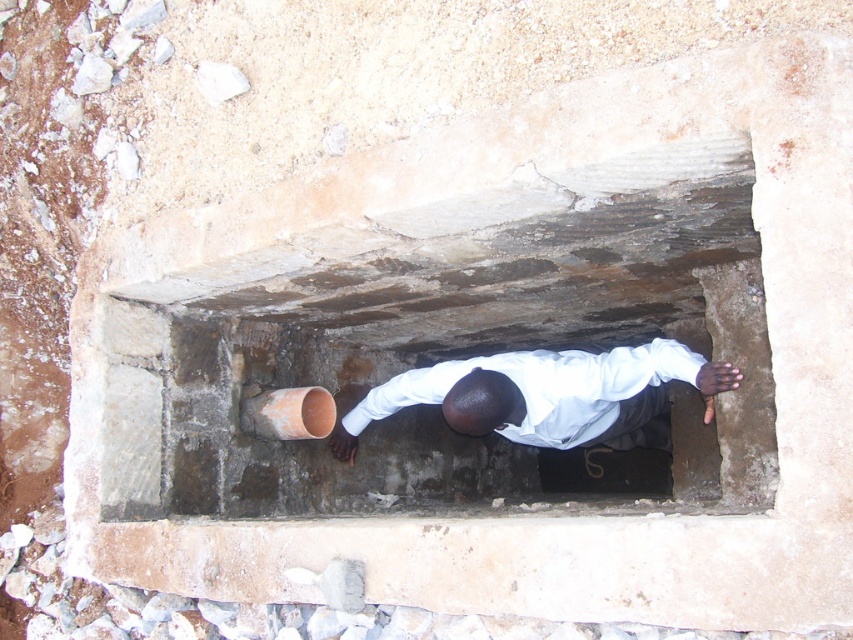
You are a construction worker needing to place a safety harness hook. You see the smooth concrete hole at center and the white matte shirt at center. Which object should you avoid placing the hook near to ensure safety?

You should avoid placing the hook near the white matte shirt at center because the smooth concrete hole at center is to the left of it, and the shirt is where the worker is positioned, making it unsafe to place the hook there.

You are a construction worker assessing a trench. You see the smooth concrete hole at center and the white matte shirt at center. Which object is taller?

The smooth concrete hole at center is much taller than the white matte shirt at center.